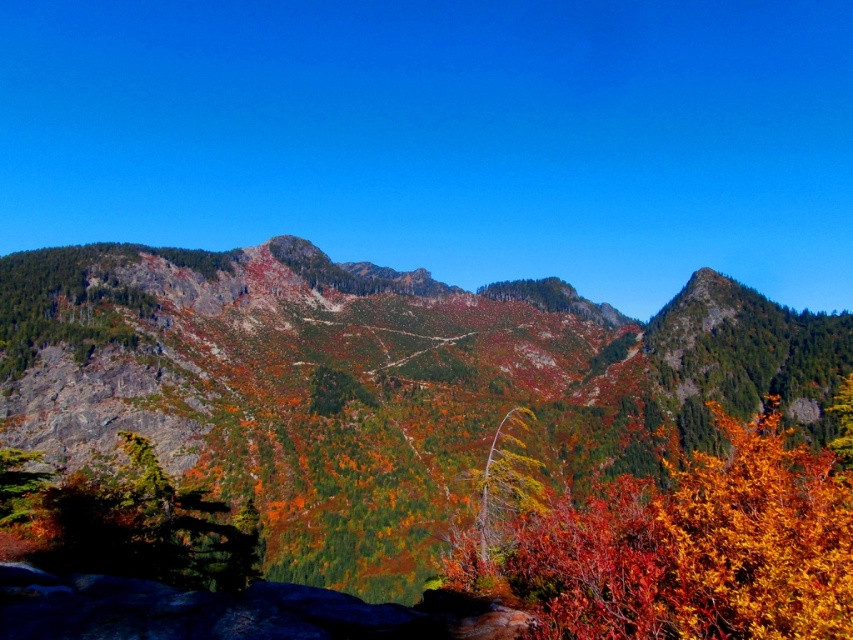
Question: Estimate the real-world distances between objects in this image. Which object is closer to the green textured tree at lower left?

Choices:
 (A) shiny orange leaves at center
 (B) rocky cliff face at center

Answer: (A)

Question: Can you confirm if rocky cliff face at center is thinner than shiny orange leaves at center?

Choices:
 (A) no
 (B) yes

Answer: (A)

Question: In this image, where is rocky cliff face at center located relative to shiny orange leaves at center?

Choices:
 (A) left
 (B) right

Answer: (A)

Question: Estimate the real-world distances between objects in this image. Which object is farther from the shiny orange leaves at center?

Choices:
 (A) green textured tree at lower left
 (B) rocky cliff face at center

Answer: (B)

Question: Which point appears closest to the camera in this image?

Choices:
 (A) (805, 481)
 (B) (343, 321)

Answer: (A)

Question: Is rocky cliff face at center below shiny orange leaves at center?

Choices:
 (A) no
 (B) yes

Answer: (A)